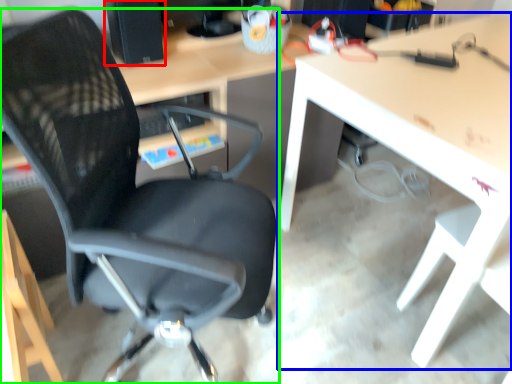
Question: Considering the real-world distances, which object is closest to desktop computer (highlighted by a red box)? table (highlighted by a blue box) or chair (highlighted by a green box).

Choices:
 (A) table
 (B) chair

Answer: (B)